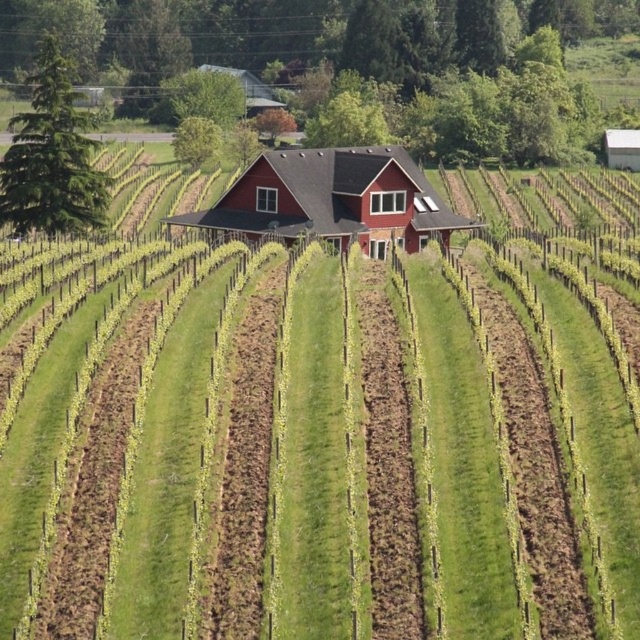
You are standing at the entrance of the vineyard and want to locate the matte red barn at center. According to the coordinates provided, where should you look relative to your position?

The matte red barn at center is located at coordinates point (333, 198), which means it is positioned slightly to the right and forward from your current position at the entrance.

From the picture: You are standing at the camera position looking at the vineyard scene. There are two points marked in the image, one at coordinates point (348, 241) and another at point (621, 144). Which of these points is physically closer to your current position?

Point (348, 241) is closer to the camera than point (621, 144), so the point at coordinates point (348, 241) is physically closer to your current position.

You are a drone operator tasked with capturing aerial footage of the vineyard. Your drone has a maximum flight range of 70 meters from its starting point at the matte red barn at center. Can the drone reach the white corrugated metal barn at upper right without exceeding its range?

The distance between the matte red barn at center and the white corrugated metal barn at upper right is 68.64 meters, which is within the drone operator drone operator drone operator drone operator drone operator drone operator drone operator drone operator drone operator drone operator drone operator drone operator drone operator drone operator drone operator drone operator drone operator drone operator drone operator drone operator drone operator drone operator drone operator drone operator drone operator